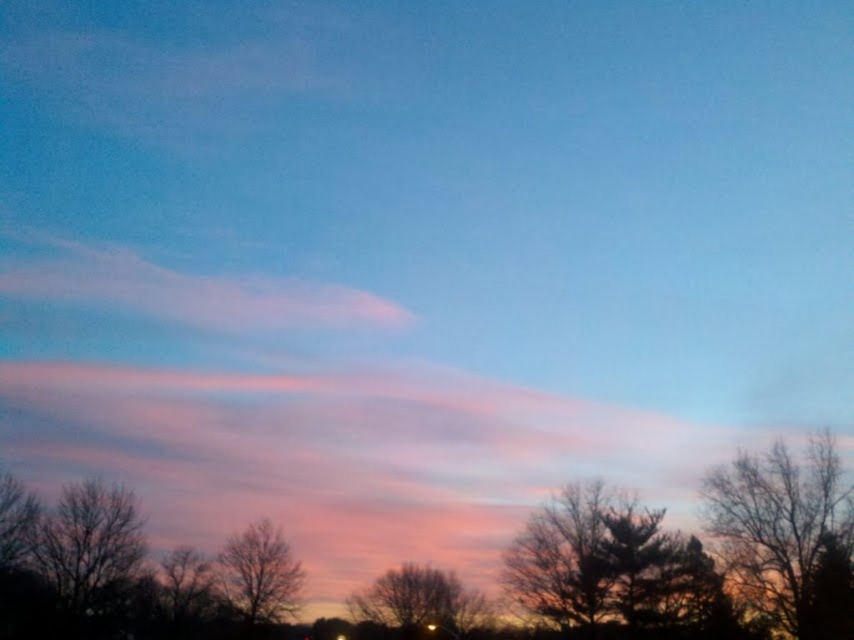
You are an artist painting this twilight scene. You want to ensure the pink translucent cloud at upper left and the bare branches at lower center are proportionally accurate. Which object should you draw taller in your painting?

The pink translucent cloud at upper left should be drawn taller than the bare branches at lower center because the description states that it has a greater height compared to them.

You are an artist sketching the twilight scene. You need to place the silhouette bare tree at right and the bare branches at lower center in your drawing. Based on their positions, which object should you draw first to ensure proper layering?

You should draw the bare branches at lower center first because the silhouette bare tree at right is positioned on the right side of it, meaning the tree is layered in front of the branches. By drawing the branches first, you can then place the tree over them for correct layering.

In the twilight scene, you see the silhouette bare tree at right and the pink translucent cloud at upper left. Which object is positioned to the right of the other?

The silhouette bare tree at right is positioned to the right of the pink translucent cloud at upper left.